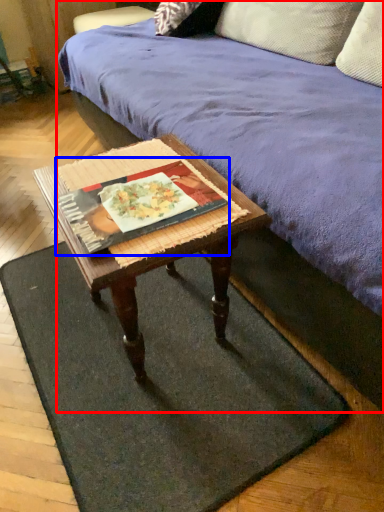
Question: Among these objects, which one is farthest to the camera, studio couch (highlighted by a red box) or book (highlighted by a blue box)?

Choices:
 (A) studio couch
 (B) book

Answer: (B)